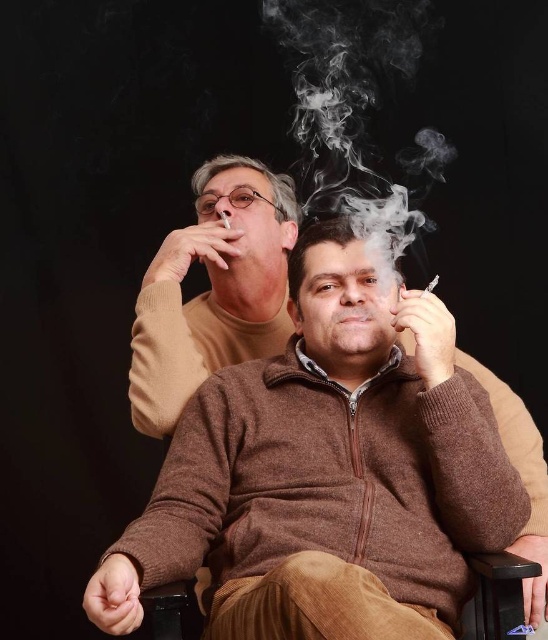
Is brown wool sweater at center taller than smooth silver cigarette at center?

Correct, brown wool sweater at center is much taller as smooth silver cigarette at center.

Consider the image. Who is more distant from viewer, (193, 188) or (425, 291)?

The point (193, 188) is more distant.

You are a GUI agent. You are given a task and a screenshot of the screen. Output one action in this format:
    pyautogui.click(x=<x>, y=<y>)
    Task: Click on the brown wool sweater at center
    The width and height of the screenshot is (548, 640).
    Given the screenshot: What is the action you would take?
    pyautogui.click(x=214, y=289)

Which is below, brown wool sweater at center or white smoke at center?

brown wool sweater at center is below.

From the picture: Between brown wool sweater at center and white smoke at center, which one is positioned higher?

white smoke at center is higher up.

You are a GUI agent. You are given a task and a screenshot of the screen. Output one action in this format:
    pyautogui.click(x=<x>, y=<y>)
    Task: Click on the brown wool sweater at center
    
    Given the screenshot: What is the action you would take?
    pyautogui.click(x=214, y=289)

Where is `brown wool sweater at center`? brown wool sweater at center is located at coordinates (214, 289).

Is the position of white smoke at center more distant than that of matte brown cigarette at upper center?

Yes.

Which is behind, point (316, 10) or point (225, 214)?

Point (316, 10)

The width and height of the screenshot is (548, 640). I want to click on white smoke at center, so click(351, 104).